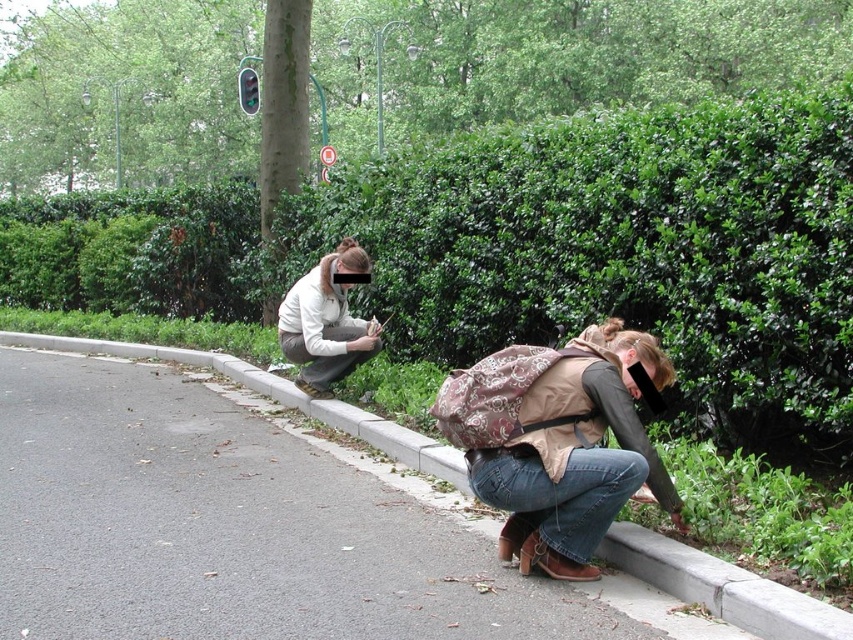
You are standing at the point marked by the coordinates point [575,454]. What object is located at that exact point?

The point [575,454] marks the brown fabric backpack at lower center.

You are standing at the edge of the road where the two people are crouching. Looking down, you notice a point marked at coordinates (x=721, y=586). What type of material is located at this point?

The point at coordinates (x=721, y=586) marks concrete at lower center.